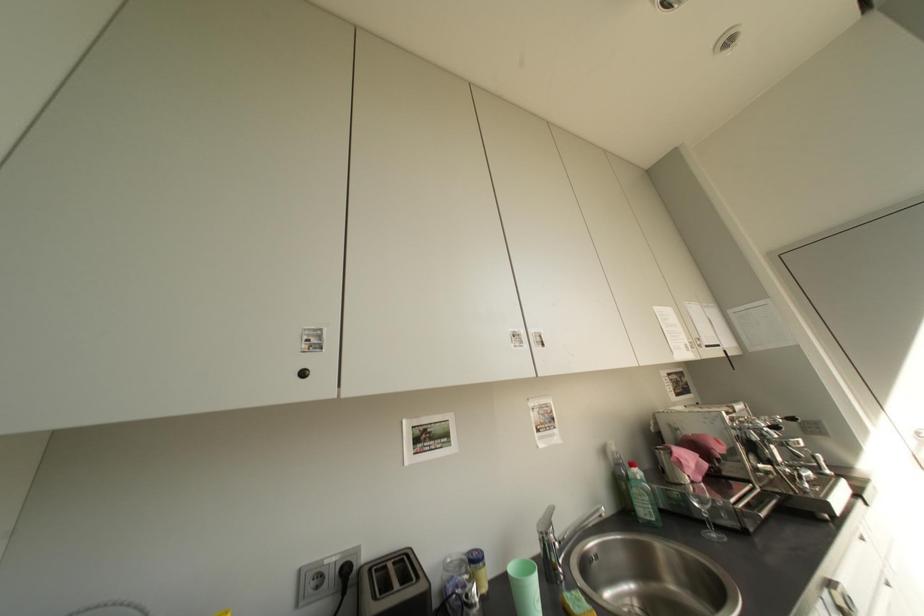
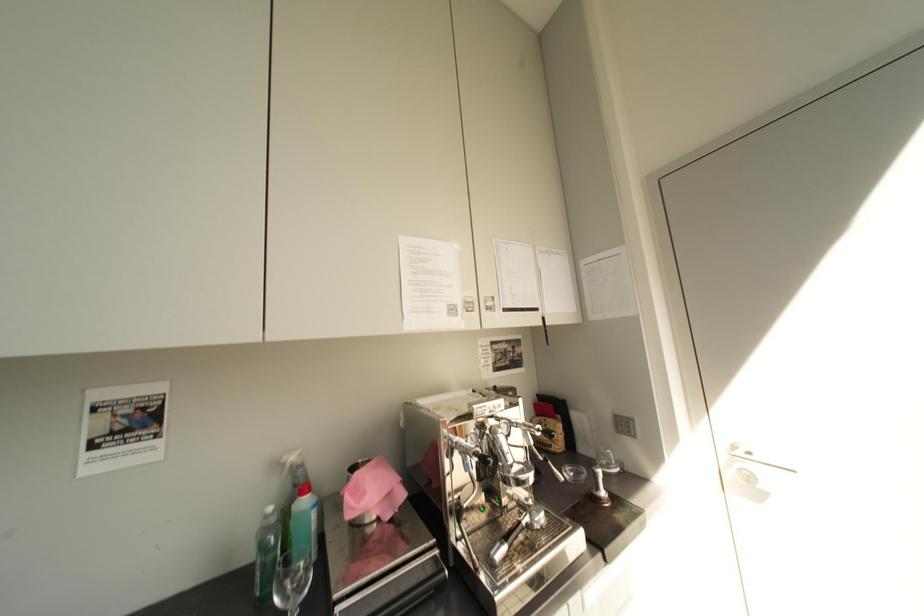
Which direction would the cameraman need to move to produce the second image?

The cameraman moved toward right, forward.